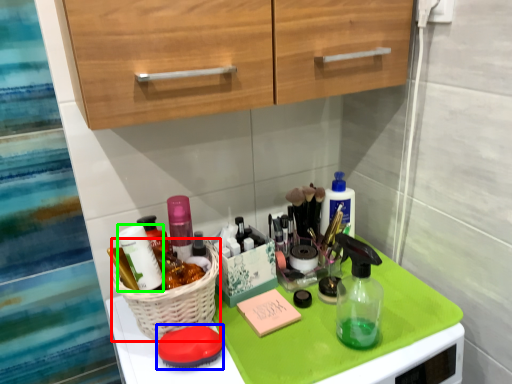
Question: Which is nearer to the basket (highlighted by a red box)? soap (highlighted by a blue box) or toiletry (highlighted by a green box).

Choices:
 (A) soap
 (B) toiletry

Answer: (A)